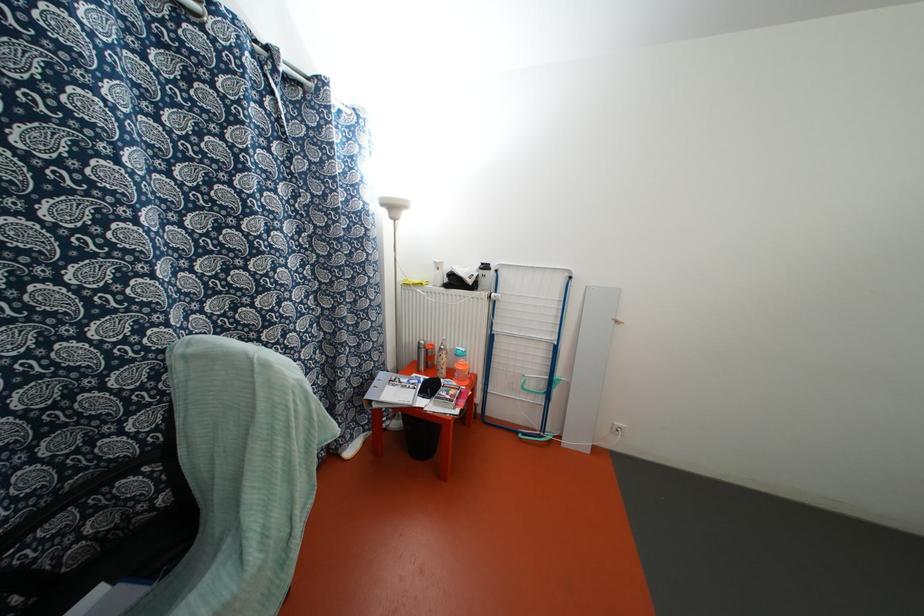
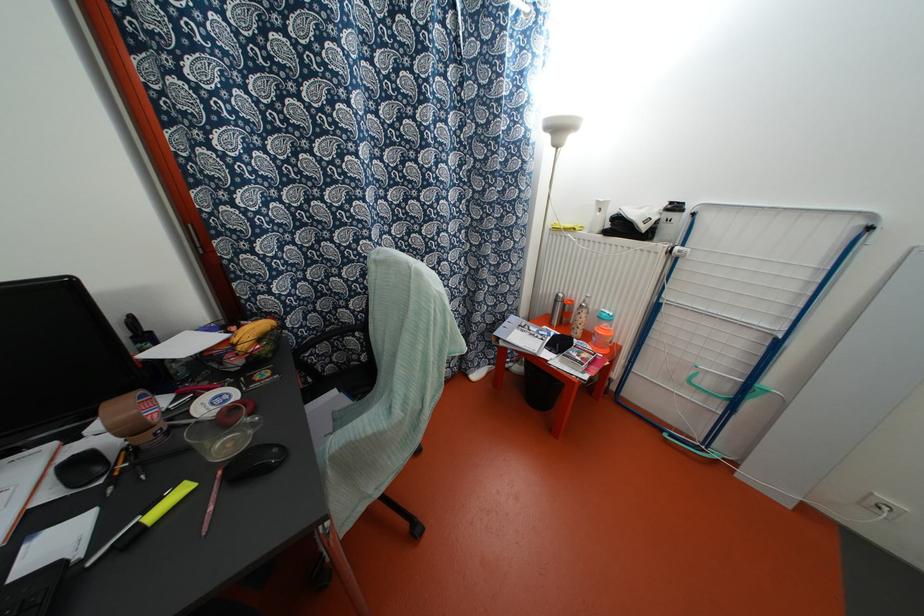
Where in the second image is the point corresponding to point 467,382 from the first image?

(606, 351)